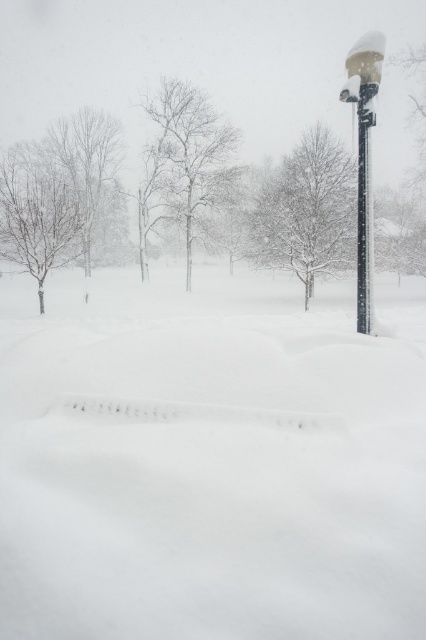
From the picture: You are a photographer trying to capture a clear shot of the black plastic pole at upper right. However, the bare branches at center are blocking your view. Based on the scene, can you determine if you can see the pole clearly without moving your position?

The black plastic pole at upper right is behind the bare branches at center, so it is partially or fully obscured by them, making it difficult to see clearly without moving your position.

You are a photographer wanting to capture both the bare branches at center and the black plastic pole at upper right in a single frame. Based on their positions, which object should you adjust your camera to focus on first to ensure both are in the shot?

Since the bare branches at center is to the left of black plastic pole at upper right, you should focus on the black plastic pole at upper right first as it is further to the right, allowing the bare branches at center to naturally fall into the frame from the left side.